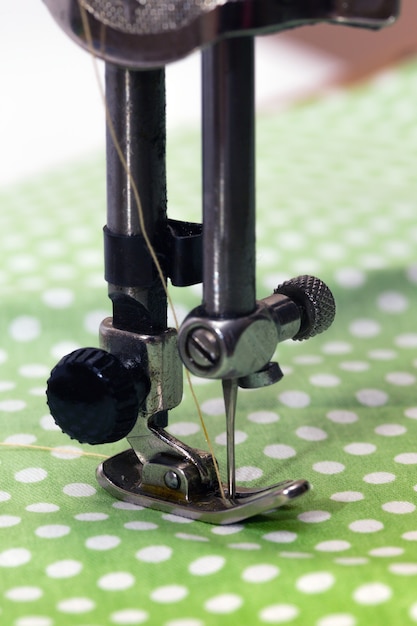
Find the location of a particular element. The width and height of the screenshot is (417, 626). hinge is located at coordinates (165, 473).